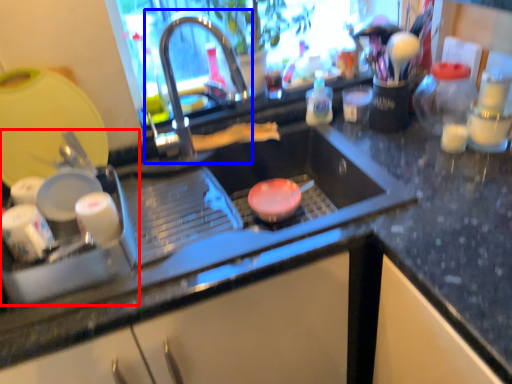
Question: Which object is further to the camera taking this photo, appliance (highlighted by a red box) or tap (highlighted by a blue box)?

Choices:
 (A) appliance
 (B) tap

Answer: (B)